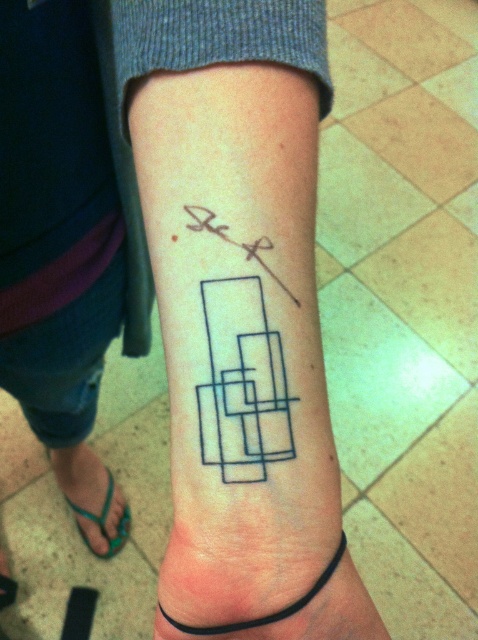
In the scene shown: Is green rubber sandal at lower left to the right of black ink square at upper center from the viewer's perspective?

No, green rubber sandal at lower left is not to the right of black ink square at upper center.

Measure the distance between green rubber sandal at lower left and black ink square at upper center.

A distance of 1.16 meters exists between green rubber sandal at lower left and black ink square at upper center.

The height and width of the screenshot is (640, 478). I want to click on green rubber sandal at lower left, so click(91, 499).

Is point (235, 122) positioned behind point (330, 600)?

That is False.

Is black ink tattoo at center smaller than black rubber band at lower center?

Result: Incorrect, black ink tattoo at center is not smaller in size than black rubber band at lower center.

Does point (349, 576) lie in front of point (335, 596)?

No.

Identify the location of black ink tattoo at center. (239, 314).

Is black ink tattoo at center positioned at the back of green rubber sandal at lower left?

No.

Locate an element on the screen. This screenshot has height=640, width=478. black ink tattoo at center is located at coordinates (239, 314).

Is point (251, 301) less distant than point (66, 451)?

Yes.

Image resolution: width=478 pixels, height=640 pixels. I want to click on black ink tattoo at center, so click(239, 314).